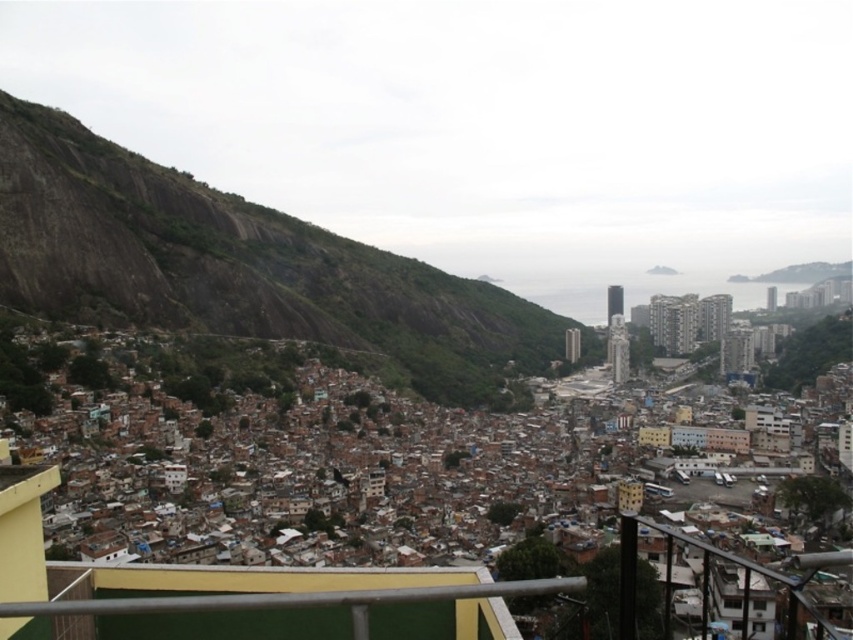
You are standing at the lower center of the image, looking towards the rustic stone mountain at left. Can you see the metallic gray railing at lower center from this vantage point?

The metallic gray railing at lower center is behind rustic stone mountain at left, so it would be obstructed from view when looking towards the mountain from that position.

You are standing at the base of the rustic stone mountain at left and want to walk towards the metallic gray railing at lower center. Which direction should you head to reach the railing?

To reach the metallic gray railing at lower center from the rustic stone mountain at left, you should head to the right since the mountain is positioned on the left side of the railing.